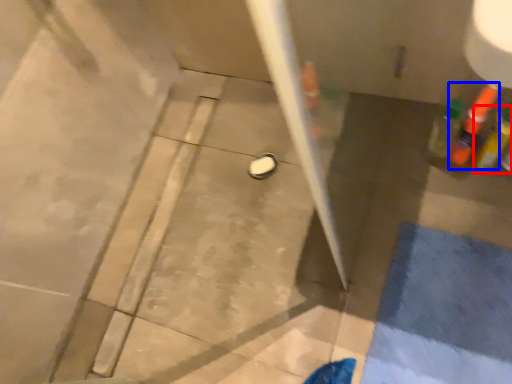
Question: Among these objects, which one is farthest to the camera, bottle (highlighted by a red box) or bottle (highlighted by a blue box)?

Choices:
 (A) bottle
 (B) bottle

Answer: (B)